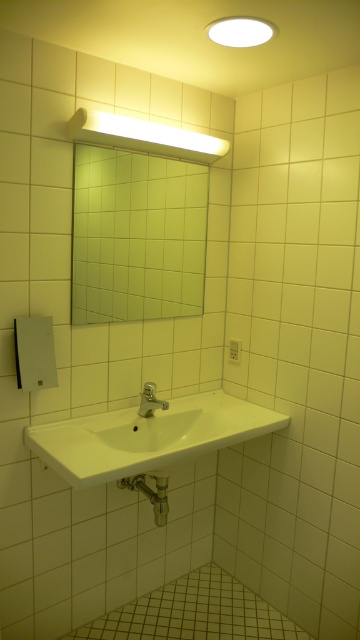
You are standing in the bathroom and want to place a small plant on the counter near the sink. The plant requires a spot that is not directly under the mirror to avoid blocking its reflection. Based on the coordinates provided, can you determine if the point at point (137, 236) is suitable for placing the plant?

The point at point (137, 236) is where the green tile mirror at upper center is located, so placing the plant there would block the mirror. Choose another spot not under the mirror.

You are standing in the bathroom and want to wash your hands. The faucet on the white glossy sink at center is 1.5 meters tall. Can you comfortably reach the faucet without bending down?

The white glossy sink at center is 1.57 meters away from you. Since the faucet is 1.5 meters tall, you can comfortably reach it without bending down as the distance allows easy access.